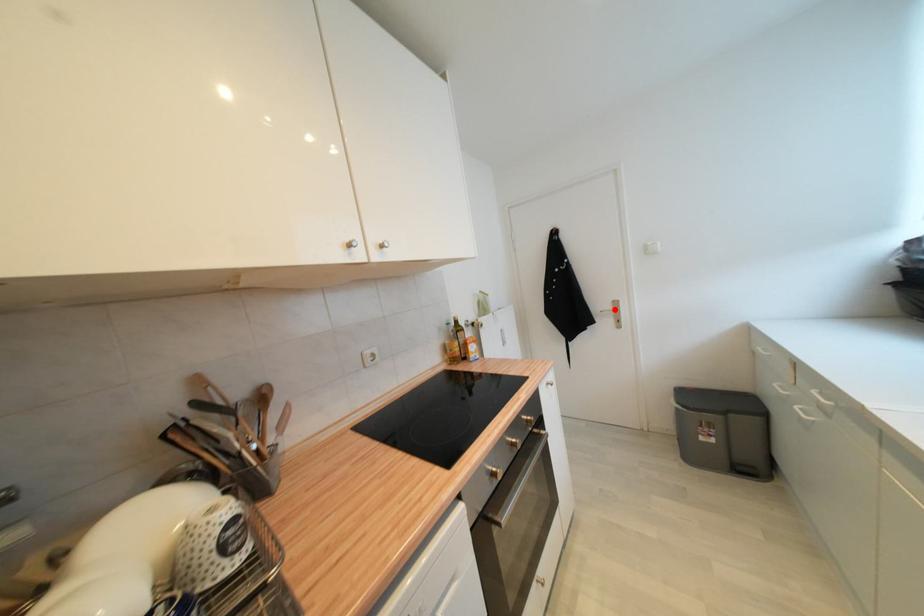
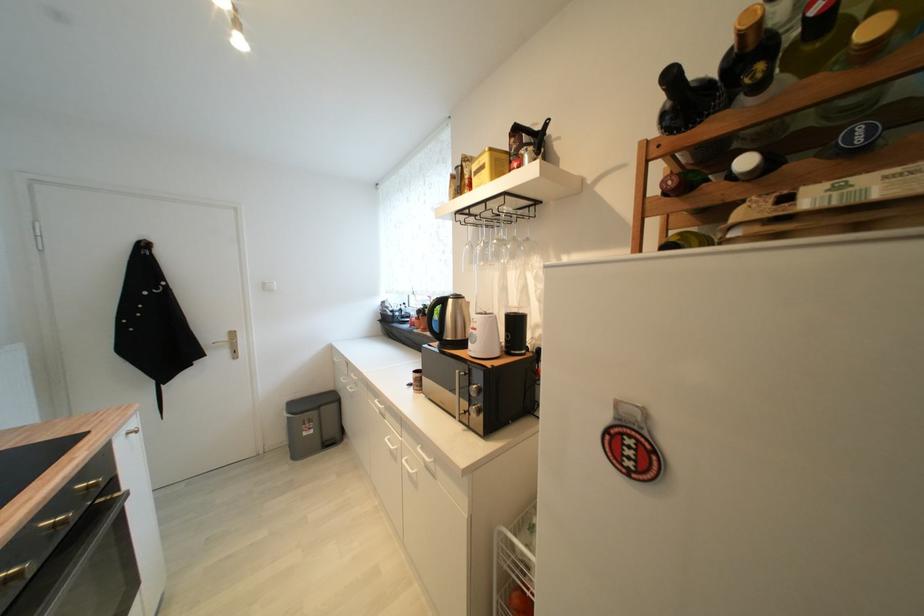
The point at the highlighted location is marked in the first image. Where is the corresponding point in the second image?

(229, 339)